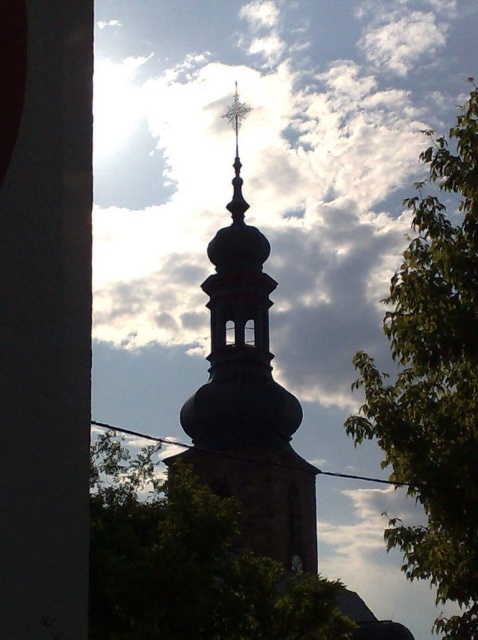
You are standing in front of the church tower and notice two green leafy trees in the image. Which tree, the green leafy tree at right or the green leafy tree at center, is closer to you?

The green leafy tree at right is positioned over the green leafy tree at center, meaning it is closer to you.

You are an architect analyzing the image. You need to determine which object, the green leafy tree at right or the dark brown stone tower at center, reaches a higher elevation in the scene. Based on the provided information, which one is taller?

The green leafy tree at right has a greater height compared to the dark brown stone tower at center, so the green leafy tree at right is taller.

You are an architect analyzing the image. You need to determine which object occupies more space in the scene between the green leafy tree at right and the dark brown stone tower at center. Which one is bigger?

The green leafy tree at right is larger in size than the dark brown stone tower at center, so the green leafy tree at right occupies more space in the scene.